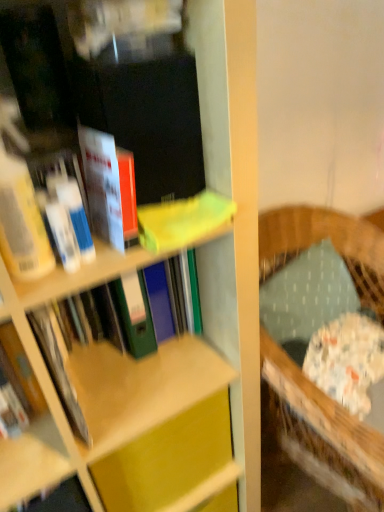
Question: Does matte green folder at center, the third book viewed from the front, have a larger size compared to textured green pillow at right?

Choices:
 (A) no
 (B) yes

Answer: (B)

Question: Considering the relative sizes of matte green folder at center, positioned as the 1th book in back-to-front order, and textured green pillow at right in the image provided, is matte green folder at center, positioned as the 1th book in back-to-front order, shorter than textured green pillow at right?

Choices:
 (A) no
 (B) yes

Answer: (A)

Question: Is matte green folder at center, positioned as the 1th book in back-to-front order, wider than textured green pillow at right?

Choices:
 (A) yes
 (B) no

Answer: (A)

Question: Can you confirm if matte green folder at center, positioned as the 1th book in back-to-front order, is positioned to the right of textured green pillow at right?

Choices:
 (A) no
 (B) yes

Answer: (A)

Question: Is matte green folder at center, positioned as the 1th book in back-to-front order, far from textured green pillow at right?

Choices:
 (A) no
 (B) yes

Answer: (A)

Question: Is matte green folder at center, the third book viewed from the front, aimed at textured green pillow at right?

Choices:
 (A) yes
 (B) no

Answer: (B)

Question: Considering the relative sizes of wooden rocking chair at right and matte yellow cabinet at center in the image provided, is wooden rocking chair at right bigger than matte yellow cabinet at center?

Choices:
 (A) yes
 (B) no

Answer: (A)

Question: Is wooden rocking chair at right further to camera compared to matte yellow cabinet at center?

Choices:
 (A) yes
 (B) no

Answer: (B)

Question: Can you confirm if wooden rocking chair at right is positioned to the right of matte yellow cabinet at center?

Choices:
 (A) yes
 (B) no

Answer: (A)

Question: Does wooden rocking chair at right turn towards matte yellow cabinet at center?

Choices:
 (A) no
 (B) yes

Answer: (A)

Question: Are wooden rocking chair at right and matte yellow cabinet at center making contact?

Choices:
 (A) yes
 (B) no

Answer: (B)

Question: Considering the relative positions of wooden rocking chair at right and matte yellow cabinet at center in the image provided, is wooden rocking chair at right in front of matte yellow cabinet at center?

Choices:
 (A) no
 (B) yes

Answer: (B)

Question: Is textured green pillow at right to the right of matte yellow book at upper center, the second book positioned from the front, from the viewer's perspective?

Choices:
 (A) yes
 (B) no

Answer: (A)